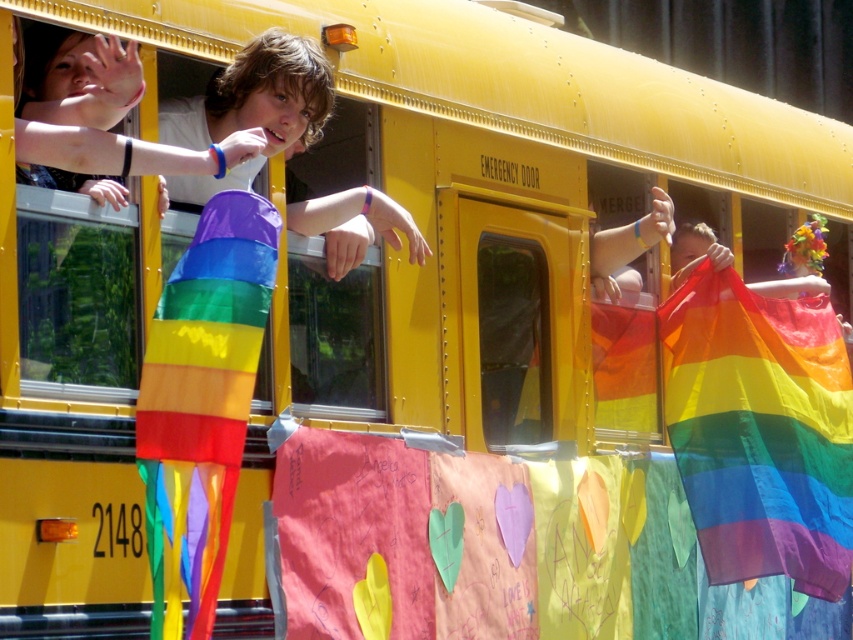
You are a photographer standing at point (759,429). You want to capture the rainbow fabric flag at center in your shot. Is there any obstruction between you and the flag?

The rainbow fabric flag at center is located at your current position, so there is no obstruction between you and the flag.